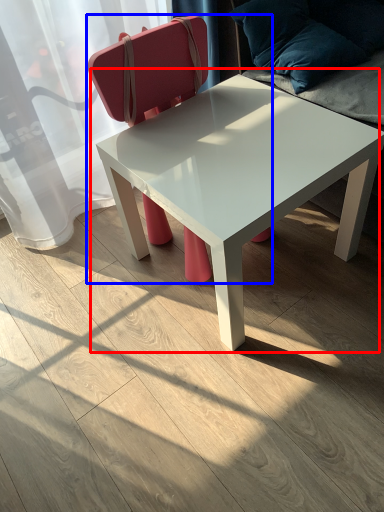
Question: Among these objects, which one is nearest to the camera, coffee table (highlighted by a red box) or chair (highlighted by a blue box)?

Choices:
 (A) coffee table
 (B) chair

Answer: (A)